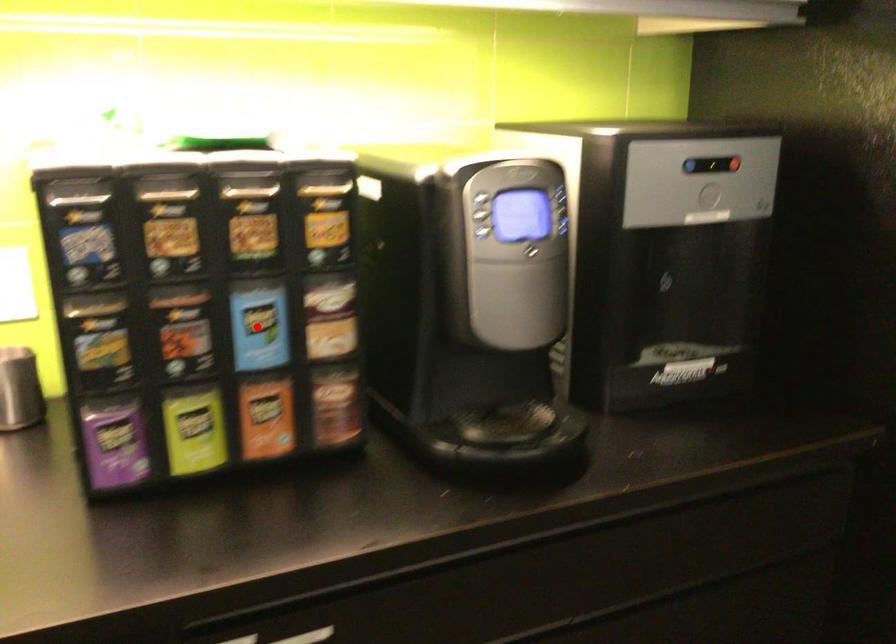
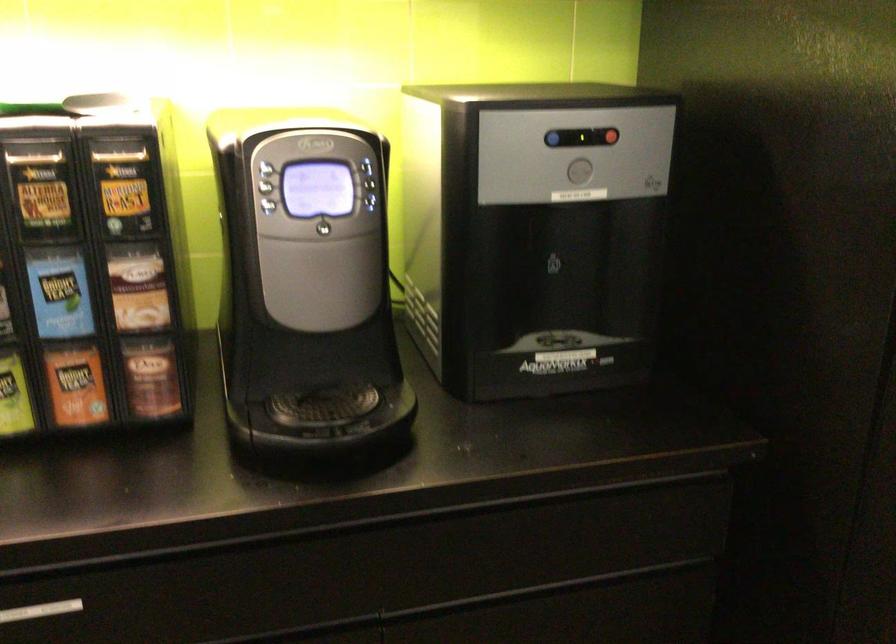
The point at the highlighted location is marked in the first image. Where is the corresponding point in the second image?

(58, 292)